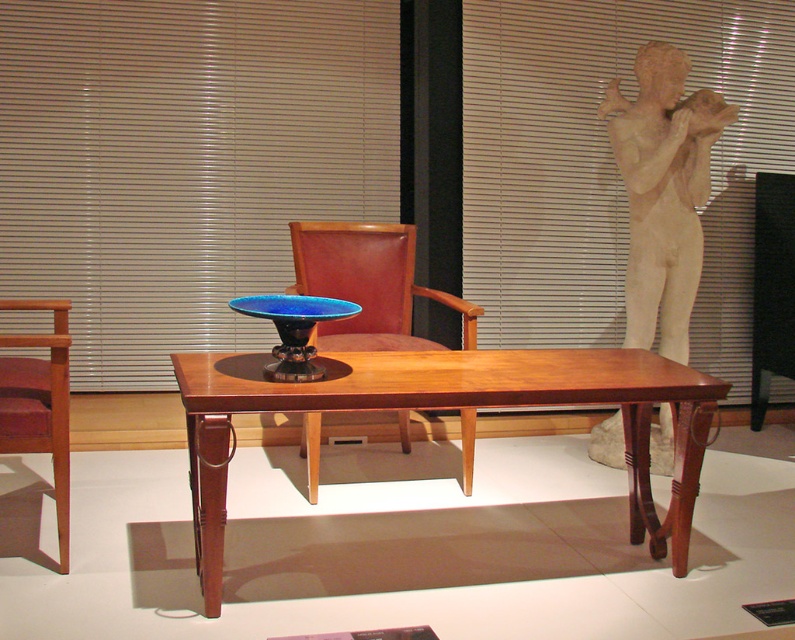
Can you confirm if beige blinds at center is positioned below mahogany wood table at center?

Actually, beige blinds at center is above mahogany wood table at center.

Is point (181, 6) closer to camera compared to point (530, 388)?

No.

Between point (159, 58) and point (638, 424), which one is positioned behind?

Point (159, 58)

Locate an element on the screen. The image size is (795, 640). beige blinds at center is located at coordinates (183, 163).

Looking at this image, which is more to the right, beige blinds at center or mahogany wood chair at left?

mahogany wood chair at left is more to the right.

Between point (194, 340) and point (39, 444), which one is positioned in front?

Point (39, 444)

Image resolution: width=795 pixels, height=640 pixels. What are the coordinates of `beige blinds at center` in the screenshot? It's located at (183, 163).

Is matte white blind at upper right above blue glass bowl at center?

Yes, matte white blind at upper right is above blue glass bowl at center.

Can you confirm if matte white blind at upper right is shorter than blue glass bowl at center?

No, matte white blind at upper right is not shorter than blue glass bowl at center.

Is point (712, 275) closer to viewer compared to point (295, 321)?

No, it is not.

At what (x,y) coordinates should I click in order to perform the action: click on matte white blind at upper right. Please return your answer as a coordinate pair (x, y). The height and width of the screenshot is (640, 795). Looking at the image, I should click on (609, 164).